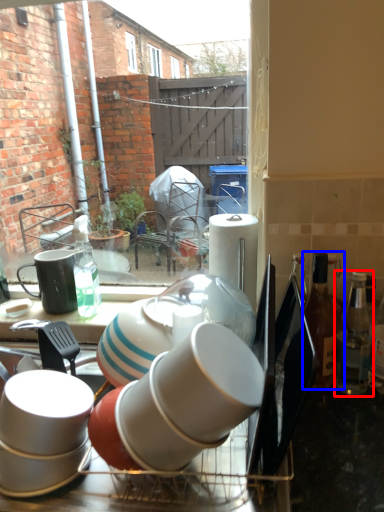
Question: Which point is closer to the camera, bottle (highlighted by a red box) or bottle (highlighted by a blue box)?

Choices:
 (A) bottle
 (B) bottle

Answer: (A)